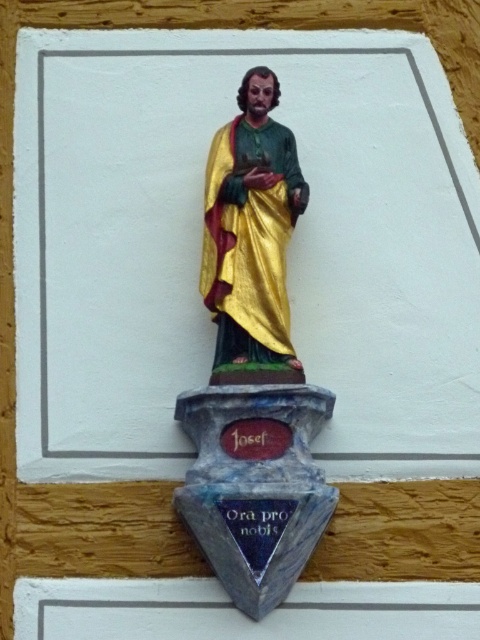
Question: Can you confirm if gold painted statue at center is positioned below gold/glossy statue at center?

Choices:
 (A) no
 (B) yes

Answer: (B)

Question: Which point is closer to the camera?

Choices:
 (A) gold painted statue at center
 (B) gold/glossy statue at center

Answer: (A)

Question: Observing the image, what is the correct spatial positioning of gold painted statue at center in reference to gold/glossy statue at center?

Choices:
 (A) above
 (B) below

Answer: (B)

Question: Which object appears closest to the camera in this image?

Choices:
 (A) gold/glossy statue at center
 (B) gold painted statue at center

Answer: (B)

Question: Among these objects, which one is farthest from the camera?

Choices:
 (A) gold/glossy statue at center
 (B) gold painted statue at center

Answer: (A)

Question: Is gold painted statue at center wider than gold/glossy statue at center?

Choices:
 (A) yes
 (B) no

Answer: (A)